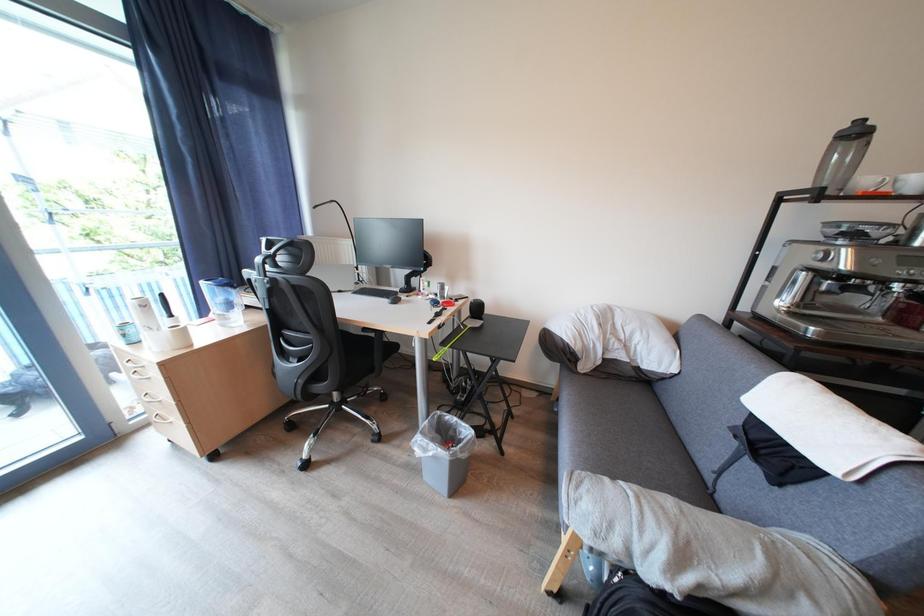
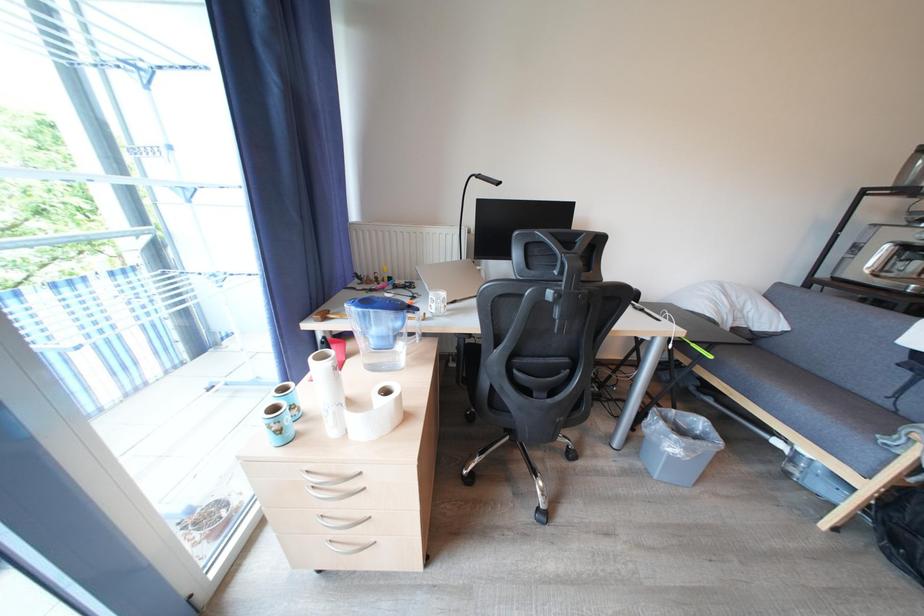
Question: The images are taken continuously from a first-person perspective. In which direction are you moving?

Choices:
 (A) Left
 (B) Right
 (C) Forward
 (D) Backward

Answer: (A)